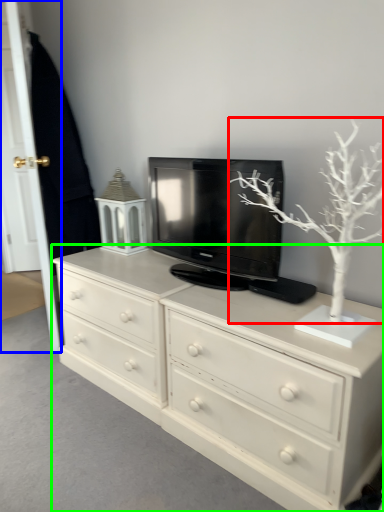
Question: Considering the real-world distances, which object is closest to tree (highlighted by a red box)? door (highlighted by a blue box) or chest of drawers (highlighted by a green box).

Choices:
 (A) door
 (B) chest of drawers

Answer: (B)